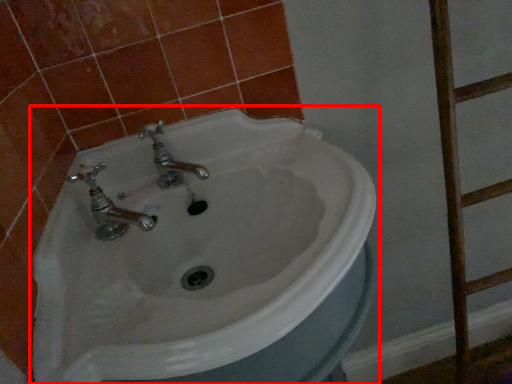
Question: From the image's perspective, what is the correct spatial relationship of sink (annotated by the red box) in relation to ladder?

Choices:
 (A) above
 (B) below

Answer: (B)